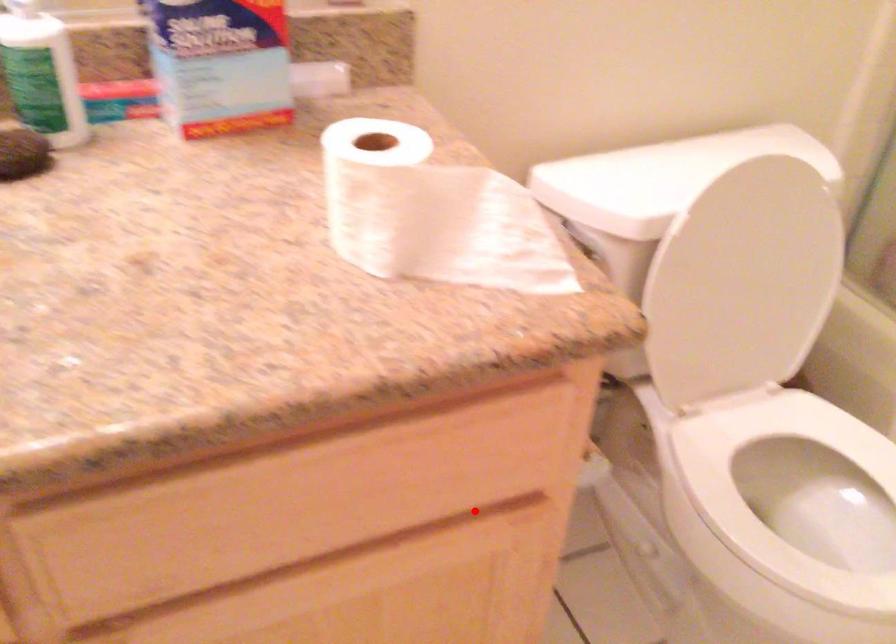
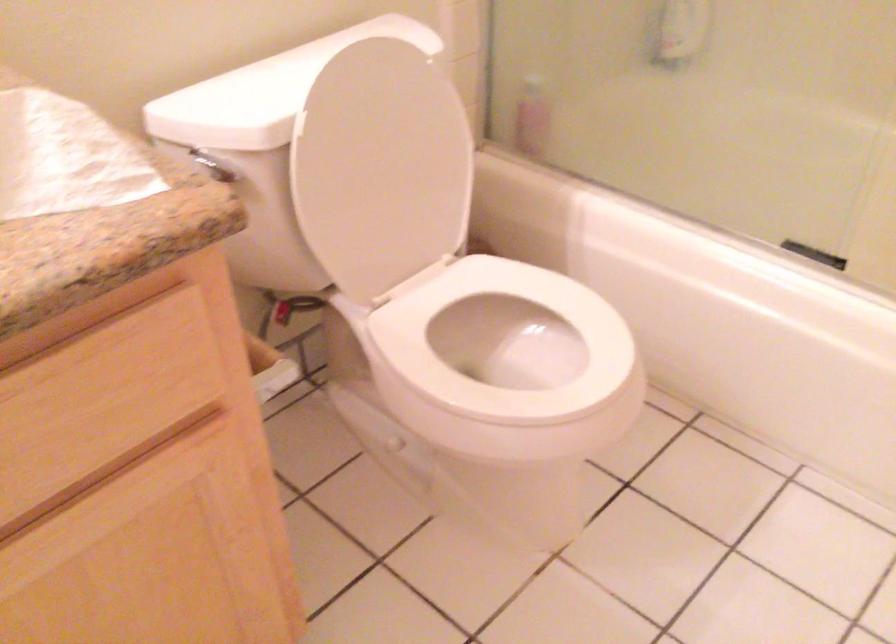
The point at the highlighted location is marked in the first image. Where is the corresponding point in the second image?

(164, 440)